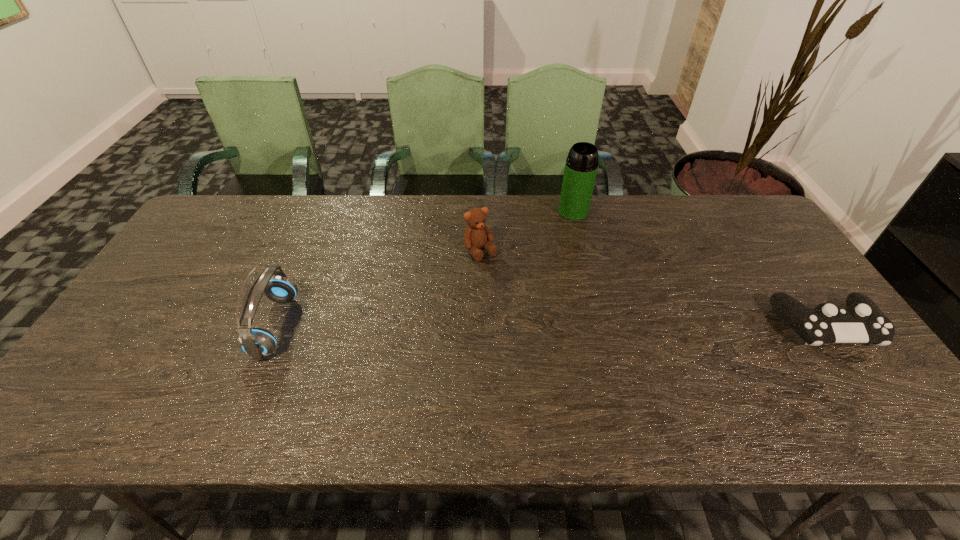
I want to click on free region at the far edge of the desktop, so click(502, 208).

The image size is (960, 540). I want to click on vacant position at the near edge of the desktop, so 344,373.

The width and height of the screenshot is (960, 540). In the image, there is a desktop. Find the location of `vacant space at the left edge`. vacant space at the left edge is located at coordinates (152, 288).

I want to click on vacant space at the right edge of the desktop, so click(x=780, y=265).

At what (x,y) coordinates should I click in order to perform the action: click on vacant space at the far right corner. Please return your answer as a coordinate pair (x, y). Image resolution: width=960 pixels, height=540 pixels. Looking at the image, I should click on [753, 210].

Identify the location of free space between the third shortest object and the tallest object. (424, 268).

Identify the location of unoccupied position between the shortest object and the teddy bear. The image size is (960, 540). (653, 288).

This screenshot has height=540, width=960. I want to click on vacant area that lies between the rightmost object and the third nearest object, so click(x=653, y=288).

The height and width of the screenshot is (540, 960). I want to click on free space between the second tallest object and the shortest object, so click(550, 326).

The height and width of the screenshot is (540, 960). I want to click on vacant space in between the control and the third object from right to left, so click(653, 288).